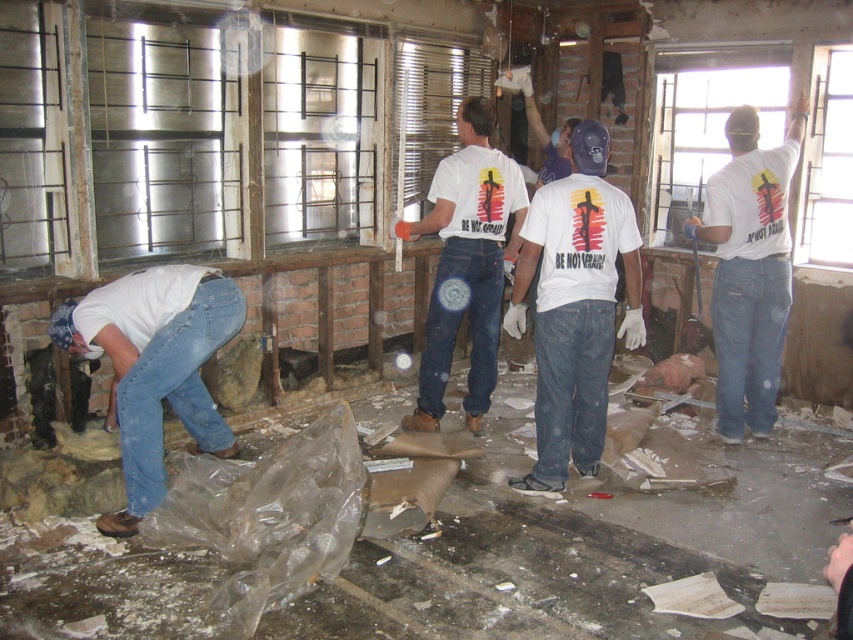
Question: Does white matte t-shirt at center appear on the right side of white matte shirt at lower left?

Choices:
 (A) no
 (B) yes

Answer: (B)

Question: Is white matte t-shirt at center above white t-shirt at upper right?

Choices:
 (A) no
 (B) yes

Answer: (A)

Question: Which of the following is the farthest from the observer?

Choices:
 (A) (184, 413)
 (B) (752, 161)
 (C) (437, 230)

Answer: (C)

Question: Among these objects, which one is nearest to the camera?

Choices:
 (A) white t-shirt at center
 (B) white matte shirt at lower left
 (C) white matte t-shirt at center
 (D) white t-shirt at upper right

Answer: (B)

Question: Which point is farther from the camera taking this photo?

Choices:
 (A) (741, 136)
 (B) (463, 147)
 (C) (570, 339)

Answer: (B)

Question: Can you confirm if white matte shirt at lower left is bigger than white t-shirt at center?

Choices:
 (A) yes
 (B) no

Answer: (B)